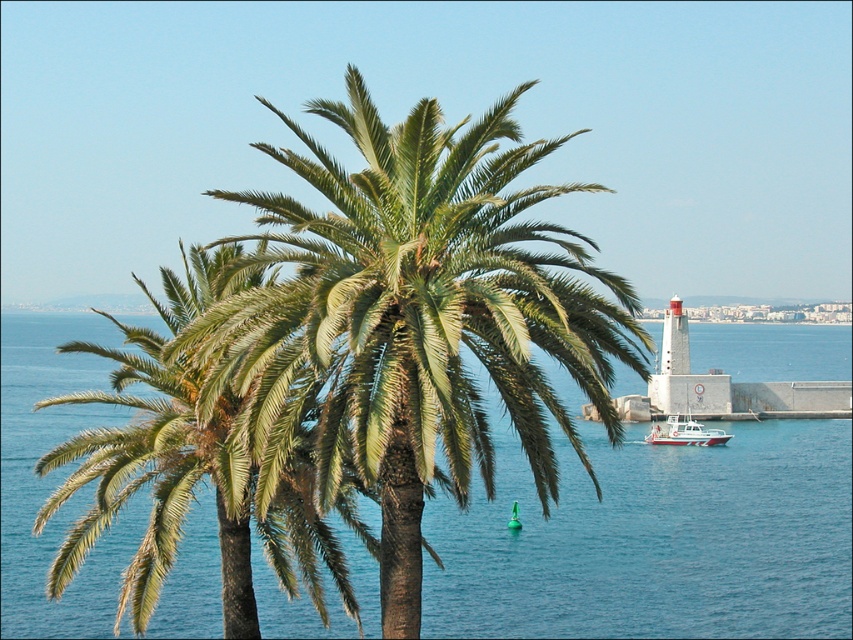
Is green leafy palm at center bigger than white plastic boat at center-right?

Correct, green leafy palm at center is larger in size than white plastic boat at center-right.

Which is below, green leafy palm at center or white plastic boat at center-right?

white plastic boat at center-right is lower down.

Consider the image. Who is more distant from viewer, [321,593] or [668,440]?

Positioned behind is point [668,440].

Where is `green leafy palm at center`? This screenshot has height=640, width=853. green leafy palm at center is located at coordinates (160, 449).

Can you confirm if blue water at center is thinner than green leafy palm tree at center?

Incorrect, blue water at center's width is not less than green leafy palm tree at center's.

Does blue water at center appear on the right side of green leafy palm tree at center?

Indeed, blue water at center is positioned on the right side of green leafy palm tree at center.

Measure the distance between blue water at center and camera.

53.63 meters

The width and height of the screenshot is (853, 640). I want to click on blue water at center, so click(x=653, y=540).

Who is positioned more to the left, blue water at center or white plastic boat at center-right?

blue water at center is more to the left.

Which is more to the right, blue water at center or white plastic boat at center-right?

From the viewer's perspective, white plastic boat at center-right appears more on the right side.

The height and width of the screenshot is (640, 853). Describe the element at coordinates (653, 540) in the screenshot. I see `blue water at center` at that location.

Where is `blue water at center`? blue water at center is located at coordinates (653, 540).